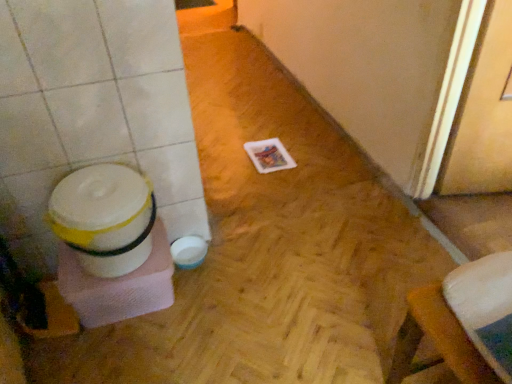
Describe the element at coordinates (105, 217) in the screenshot. I see `white plastic potty at left` at that location.

Find the location of `white plastic potty at left`. white plastic potty at left is located at coordinates (105, 217).

This screenshot has height=384, width=512. Describe the element at coordinates (483, 114) in the screenshot. I see `wooden screen door at right` at that location.

What are the coordinates of `wooden screen door at right` in the screenshot? It's located at (483, 114).

The height and width of the screenshot is (384, 512). I want to click on white plastic potty at left, so click(x=105, y=217).

Considering the positions of objects wooden screen door at right and white plastic potty at left in the image provided, who is more to the left, wooden screen door at right or white plastic potty at left?

From the viewer's perspective, white plastic potty at left appears more on the left side.

Between wooden screen door at right and white plastic potty at left, which one is positioned behind?

white plastic potty at left is further from the camera.

Is point (492, 92) positioned behind point (109, 237)?

Yes, it is.

From the image's perspective, relative to white plastic potty at left, is wooden screen door at right above or below?

Based on their image positions, wooden screen door at right is located above white plastic potty at left.

From a real-world perspective, which is physically below, wooden screen door at right or white plastic potty at left?

white plastic potty at left.

Considering the sizes of wooden screen door at right and white plastic potty at left in the image, is wooden screen door at right wider or thinner than white plastic potty at left?

Considering their sizes, wooden screen door at right looks slimmer than white plastic potty at left.

Is wooden screen door at right taller or shorter than white plastic potty at left?

In the image, wooden screen door at right appears to be taller than white plastic potty at left.

Between wooden screen door at right and white plastic potty at left, which one has smaller size?

white plastic potty at left.

Is wooden screen door at right positioned beyond the bounds of white plastic potty at left?

wooden screen door at right is positioned outside white plastic potty at left.

Is wooden screen door at right far from white plastic potty at left?

Yes, wooden screen door at right and white plastic potty at left are quite far apart.

Is wooden screen door at right positioned with its back to white plastic potty at left?

Yes, wooden screen door at right is positioned with its back facing white plastic potty at left.

How different are the orientations of wooden screen door at right and white plastic potty at left in degrees?

The angular difference between wooden screen door at right and white plastic potty at left is 89.5 degrees.

Measure the distance from wooden screen door at right to white plastic potty at left.

wooden screen door at right is 4.43 feet away from white plastic potty at left.

Where is `screen door that appears in front of the white plastic potty at left`? screen door that appears in front of the white plastic potty at left is located at coordinates (x=483, y=114).

Does white plastic potty at left appear on the right side of wooden screen door at right?

In fact, white plastic potty at left is to the left of wooden screen door at right.

Considering their positions, is white plastic potty at left located in front of or behind wooden screen door at right?

Visually, white plastic potty at left is located behind wooden screen door at right.

Which point is more distant from viewer, (106, 166) or (455, 162)?

The point (455, 162) is farther from the camera.

From the picture: From the image's perspective, relative to wooden screen door at right, is white plastic potty at left above or below?

Clearly, from the image's perspective, white plastic potty at left is below wooden screen door at right.

From a real-world perspective, which object stands above the other?

From a 3D spatial view, wooden screen door at right is above.

Does white plastic potty at left have a greater width compared to wooden screen door at right?

Yes, white plastic potty at left is wider than wooden screen door at right.

Which of these two, white plastic potty at left or wooden screen door at right, stands taller?

wooden screen door at right is taller.

In the scene shown: Is white plastic potty at left bigger or smaller than wooden screen door at right?

white plastic potty at left is smaller than wooden screen door at right.

Based on the photo, is white plastic potty at left outside of wooden screen door at right?

That's correct, white plastic potty at left is outside of wooden screen door at right.

Are white plastic potty at left and wooden screen door at right making contact?

No.

Is white plastic potty at left facing towards wooden screen door at right?

No.

How different are the orientations of white plastic potty at left and wooden screen door at right in degrees?

The facing directions of white plastic potty at left and wooden screen door at right are 89.5 degrees apart.

This screenshot has height=384, width=512. Identify the location of potty to the left of wooden screen door at right. (105, 217).

The width and height of the screenshot is (512, 384). Identify the location of screen door above the white plastic potty at left (from a real-world perspective). (483, 114).

Where is `screen door in front of the white plastic potty at left`? screen door in front of the white plastic potty at left is located at coordinates (483, 114).